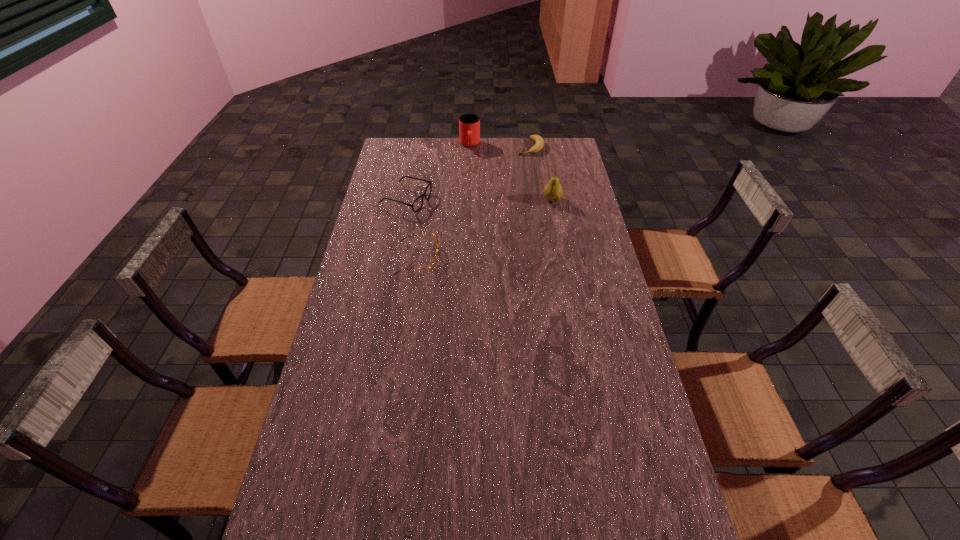
This screenshot has height=540, width=960. Identify the location of blank region between the nearer spectacles and the cup. (444, 202).

Where is `free space between the nearest object and the pear`? The width and height of the screenshot is (960, 540). free space between the nearest object and the pear is located at coordinates (485, 230).

You are a GUI agent. You are given a task and a screenshot of the screen. Output one action in this format:
    pyautogui.click(x=<x>, y=<y>)
    Task: Click on the unoccupied area between the shortest object and the nearer spectacles
    The image size is (960, 540).
    Given the screenshot: What is the action you would take?
    [474, 203]

Locate an element on the screen. Image resolution: width=960 pixels, height=540 pixels. vacant area that lies between the nearest object and the shortest object is located at coordinates (474, 203).

Locate an element on the screen. The image size is (960, 540). free spot between the banana and the third object from left to right is located at coordinates (500, 146).

Locate an element on the screen. The width and height of the screenshot is (960, 540). vacant area that lies between the farther spectacles and the nearer spectacles is located at coordinates (413, 230).

Locate an element on the screen. This screenshot has width=960, height=540. empty space between the pear and the farther spectacles is located at coordinates (479, 200).

Find the location of `the fourth closest object to the farther spectacles`. the fourth closest object to the farther spectacles is located at coordinates (553, 191).

Identify which object is located as the fourth nearest to the shortest object. Please provide its 2D coordinates. Your answer should be formatted as a tuple, i.e. [(x, y)], where the tuple contains the x and y coordinates of a point satisfying the conditions above.

[(434, 263)]

You are a GUI agent. You are given a task and a screenshot of the screen. Output one action in this format:
    pyautogui.click(x=<x>, y=<y>)
    Task: Click on the vacant space that satisfies the following two spatial constraints: 1. on the front side of the banana; 2. on the right side of the cup
    
    Given the screenshot: What is the action you would take?
    pyautogui.click(x=469, y=147)